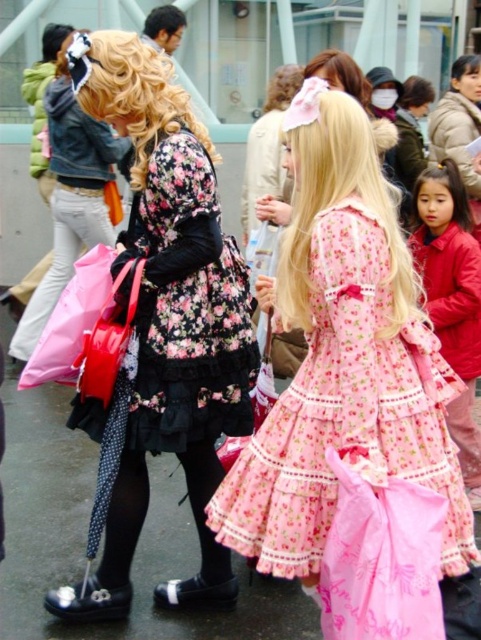
Question: Which object appears farthest from the camera in this image?

Choices:
 (A) pink fabric bag at center
 (B) pink satin dress at center
 (C) pink fabric bag at lower center

Answer: (B)

Question: From the image, what is the correct spatial relationship of pink floral fabric dress at center in relation to matte pink fabric bag at lower left?

Choices:
 (A) right
 (B) left

Answer: (A)

Question: Which of the following is the closest to the observer?

Choices:
 (A) pink fabric bag at lower center
 (B) floral-patterned fabric dress at center

Answer: (B)

Question: Does pink fabric bag at lower center appear over matte pink fabric bag at lower left?

Choices:
 (A) yes
 (B) no

Answer: (B)

Question: Which of the following is the closest to the observer?

Choices:
 (A) pink satin dress at center
 (B) pink fabric bag at center
 (C) matte pink fabric bag at lower left
 (D) floral-patterned fabric dress at center

Answer: (B)

Question: Can you confirm if pink fabric bag at lower center is wider than pink fabric bag at center?

Choices:
 (A) no
 (B) yes

Answer: (B)